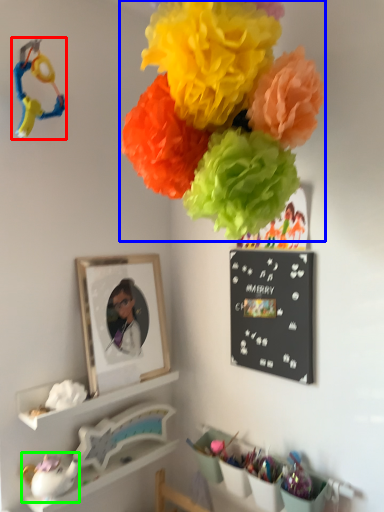
Question: Estimate the real-world distances between objects in this image. Which object is farther from toy (highlighted by a red box), flower (highlighted by a blue box) or toy (highlighted by a green box)?

Choices:
 (A) flower
 (B) toy

Answer: (B)